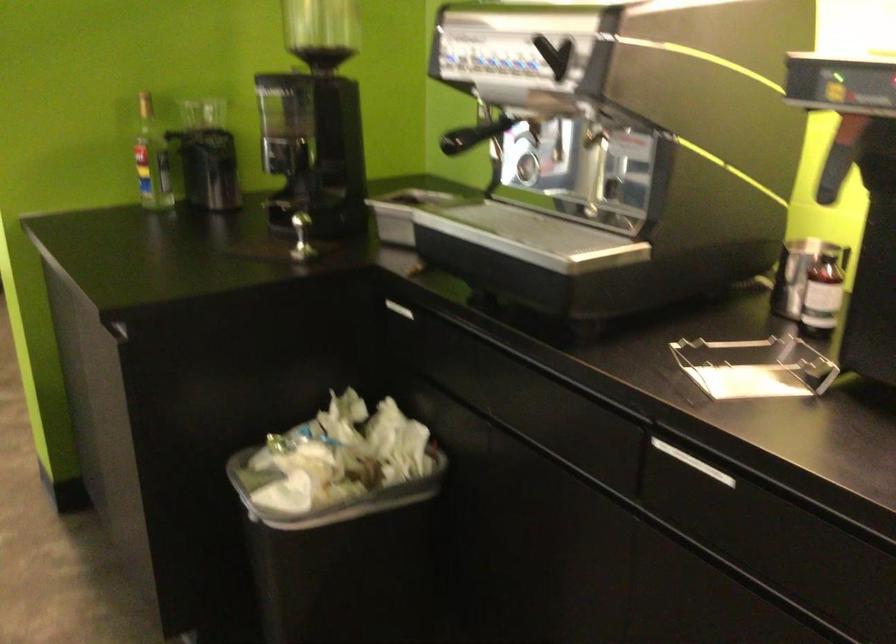
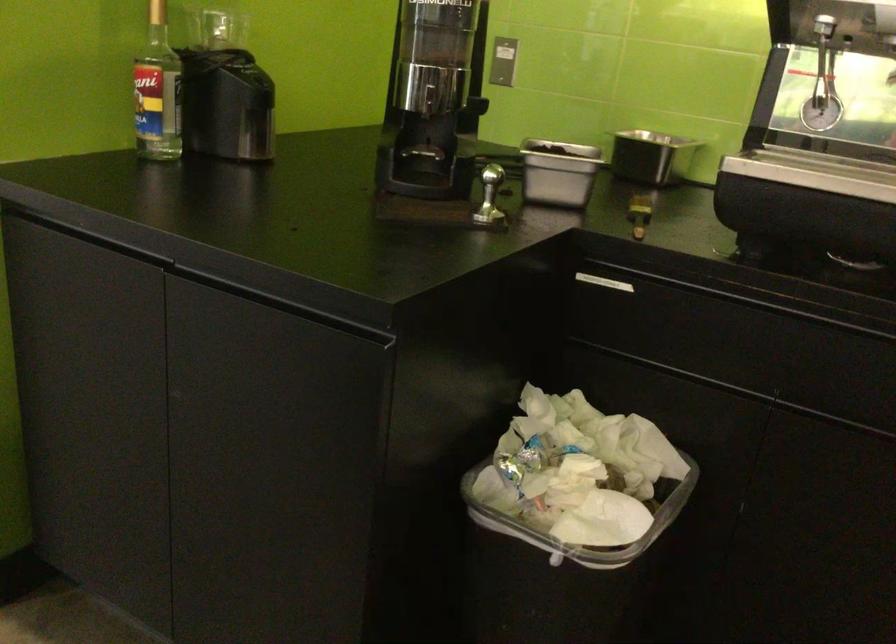
In the second image, find the point that corresponds to point (458, 317) in the first image.

(744, 287)